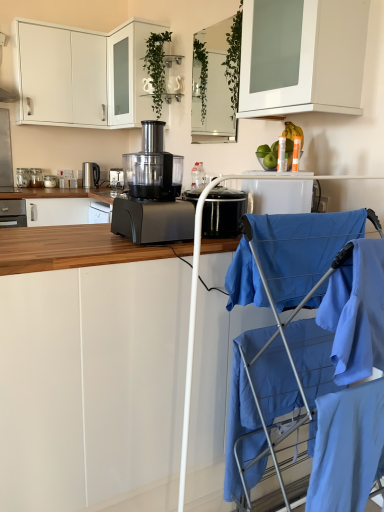
Question: Does point (233, 133) appear closer or farther from the camera than point (44, 394)?

Choices:
 (A) farther
 (B) closer

Answer: (A)

Question: Visually, is clear glass mirror at upper center, the third cabinetry from the bottom, positioned to the left or to the right of white matte cabinet at center, marked as the first cabinetry in a bottom-to-top arrangement?

Choices:
 (A) right
 (B) left

Answer: (A)

Question: Which object is the closest to the black plastic food processor at center, the second home appliance positioned from the left?

Choices:
 (A) clear glass jar at left, the second kitchen appliance when ordered from back to front
 (B) matte black food processor at center, the 5th kitchen appliance when ordered from right to left
 (C) light blue fabric at lower right
 (D) black plastic slow cooker at center, which is the second kitchen appliance in front-to-back order
 (E) green leafy plant at upper center

Answer: (A)

Question: Which is farther from the blue fabric baby carriage at right?

Choices:
 (A) white glossy cabinet at upper center, the 4th cabinetry positioned from the bottom
 (B) black plastic food processor at center, marked as the first home appliance in a right-to-left arrangement
 (C) satin silver kettle at left, arranged as the first home appliance when viewed from the left
 (D) light blue fabric at lower right
 (E) black plastic slow cooker at center, which appears as the 4th kitchen appliance when viewed from the back

Answer: (B)